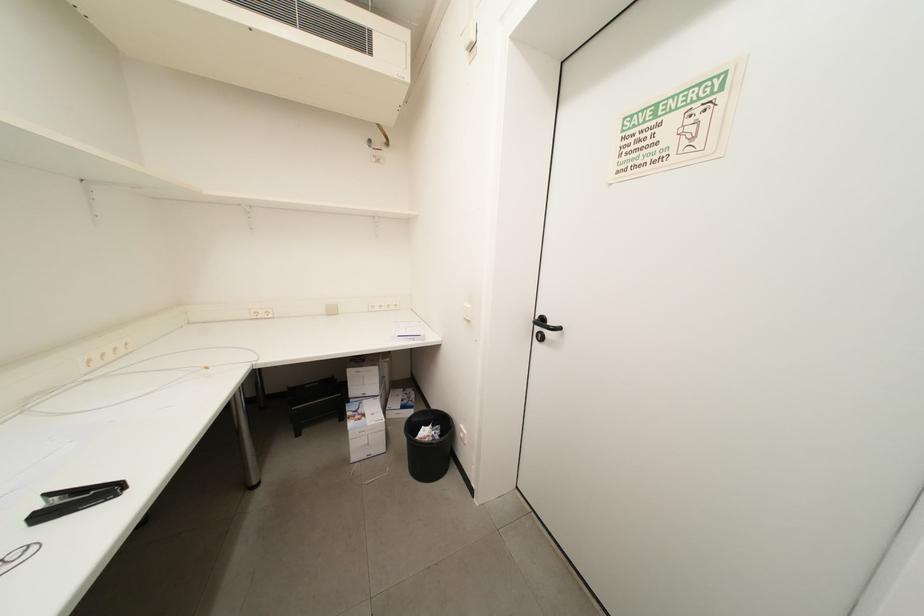
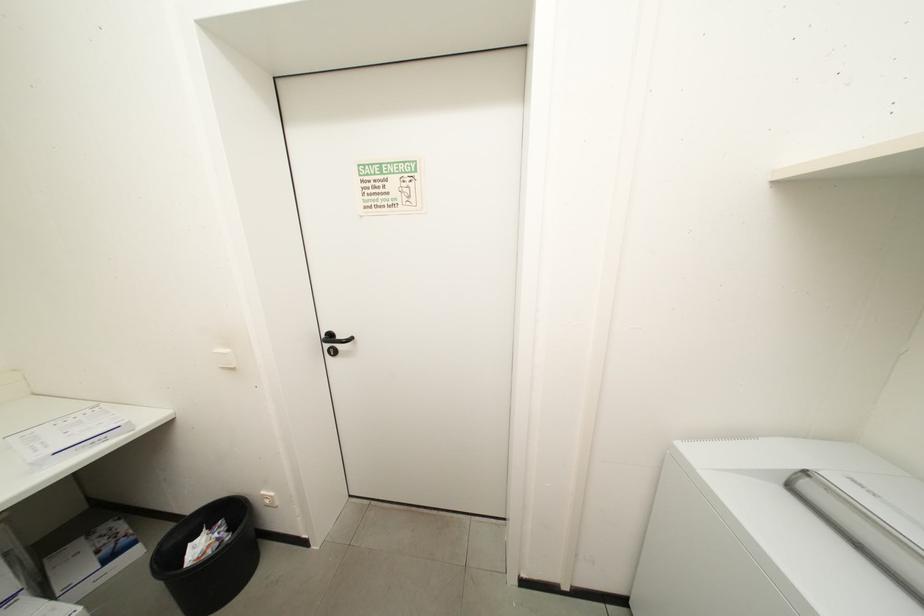
Question: Based on the continuous images, in which direction is the camera rotating? Reply with the corresponding letter.

Choices:
 (A) Left
 (B) Right
 (C) Up
 (D) Down

Answer: (B)